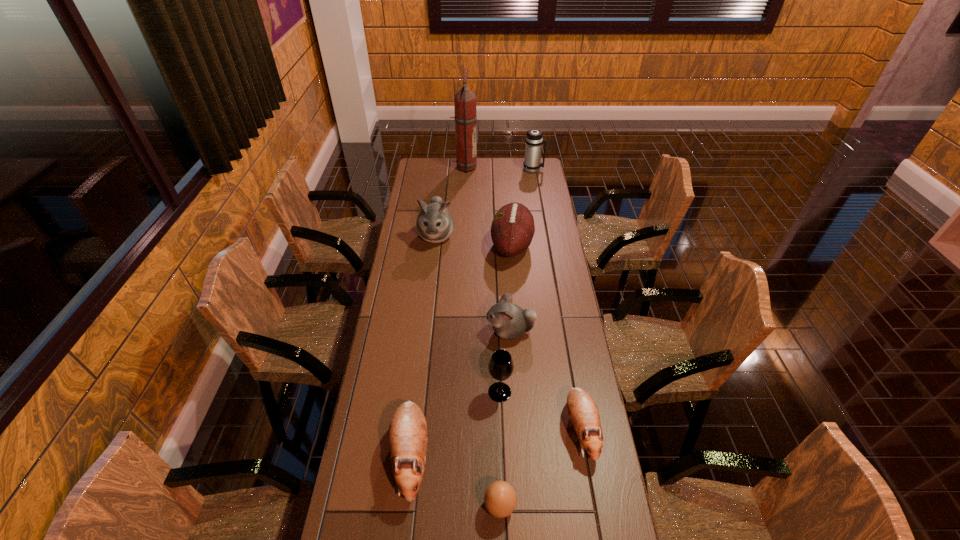
Where is `free space at the left edge of the desktop`? The width and height of the screenshot is (960, 540). free space at the left edge of the desktop is located at coordinates click(x=418, y=347).

Where is `blank space at the right edge of the desktop`? This screenshot has height=540, width=960. blank space at the right edge of the desktop is located at coordinates (560, 246).

Locate an element on the screen. free space between the smaller brown hamster and the tallest object is located at coordinates (522, 298).

Where is `vacant space that's between the smaller brown hamster and the smaller white hamster`? vacant space that's between the smaller brown hamster and the smaller white hamster is located at coordinates (545, 380).

The image size is (960, 540). What are the coordinates of `unoccupied area between the boiled egg and the nearer white hamster` in the screenshot? It's located at (505, 419).

Locate an element on the screen. free space that is in between the thermos bottle and the red fire extinguisher is located at coordinates (499, 168).

Find the location of a particular element. vacant point located between the rightmost hamster and the thermos bottle is located at coordinates (557, 299).

At what (x,y) coordinates should I click in order to perform the action: click on vacant space in between the brown football (American) and the left brown hamster. Please return your answer as a coordinate pair (x, y). Looking at the image, I should click on coord(461,350).

Identify which object is the eighth closest to the brown boiled egg. Please provide its 2D coordinates. Your answer should be formatted as a tuple, i.e. [(x, y)], where the tuple contains the x and y coordinates of a point satisfying the conditions above.

[(534, 139)]

At what (x,y) coordinates should I click in order to perform the action: click on object that ranks as the seventh closest to the brown football (American). Please return your answer as a coordinate pair (x, y). This screenshot has height=540, width=960. Looking at the image, I should click on (407, 435).